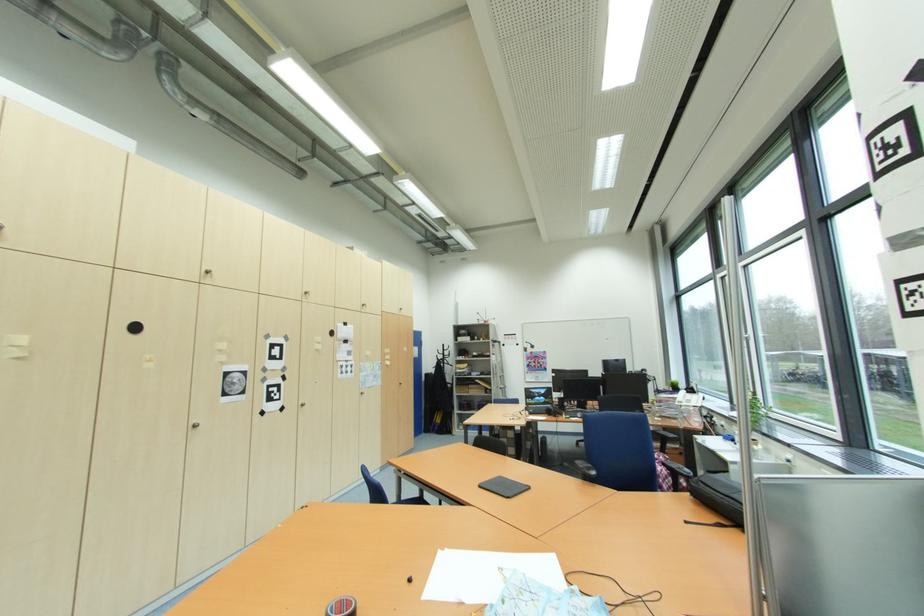
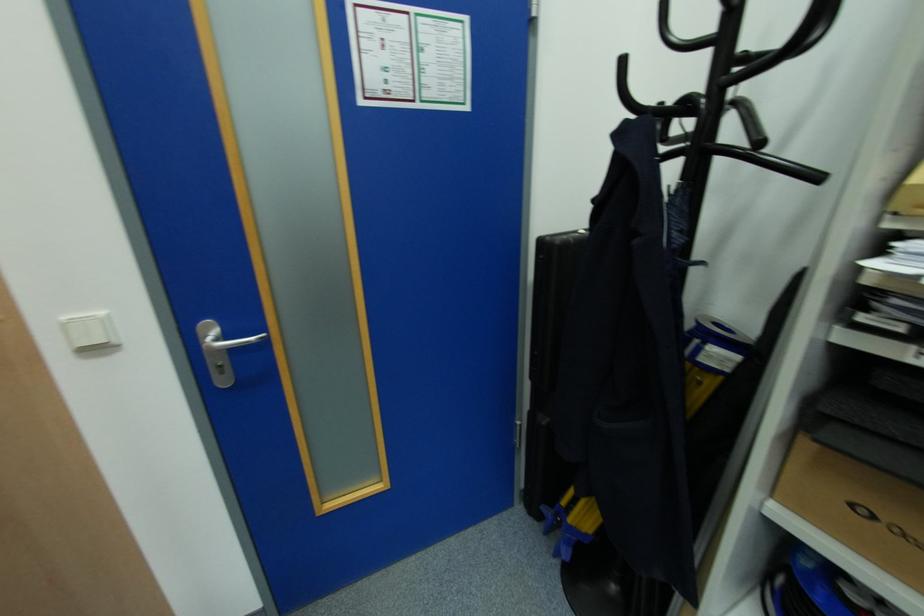
Where in the second image is the point corresponding to (x=447, y=357) from the first image?

(726, 61)